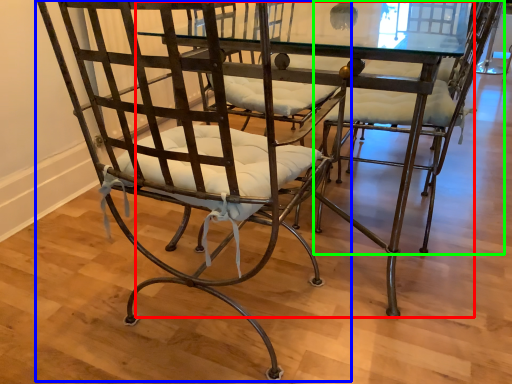
Question: Considering the real-world distances, which object is closest to round table (highlighted by a red box)? chair (highlighted by a blue box) or chair (highlighted by a green box).

Choices:
 (A) chair
 (B) chair

Answer: (A)